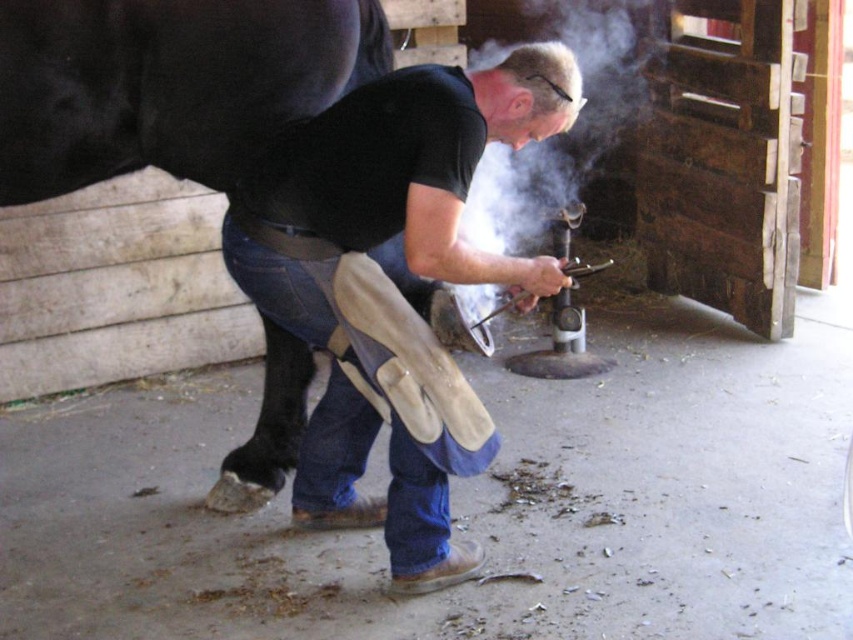
Who is shorter, leather gloves at center or blue denim jeans at center?

With less height is blue denim jeans at center.

Does leather gloves at center come in front of blue denim jeans at center?

Yes, it is.

Where is `leather gloves at center`? leather gloves at center is located at coordinates (393, 284).

The image size is (853, 640). What are the coordinates of `leather gloves at center` in the screenshot? It's located at (393, 284).